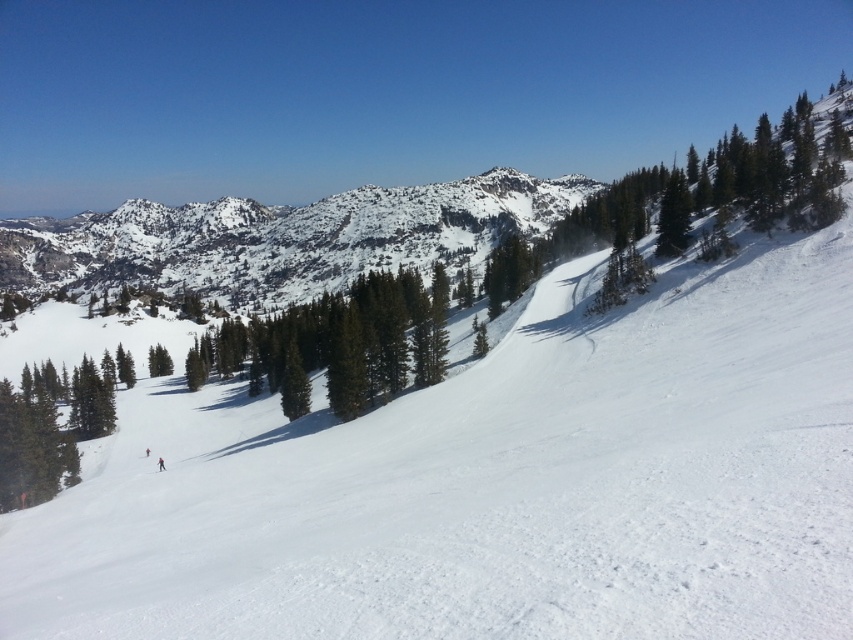
Question: Which of these objects is positioned closest to the green matte tree at center?

Choices:
 (A) snowy rocky mountain at center
 (B) red matte ski at lower left

Answer: (B)

Question: Can you confirm if snowy rocky mountain at center is smaller than green matte tree at center?

Choices:
 (A) no
 (B) yes

Answer: (A)

Question: Which of these objects is positioned closest to the red matte ski at lower left?

Choices:
 (A) snowy rocky mountain at center
 (B) green matte tree at center

Answer: (B)

Question: Can you confirm if snowy rocky mountain at center is positioned to the right of red matte ski at lower left?

Choices:
 (A) yes
 (B) no

Answer: (B)

Question: Does snowy rocky mountain at center appear on the left side of red matte ski at lower left?

Choices:
 (A) no
 (B) yes

Answer: (B)

Question: Among these points, which one is farthest from the camera?

Choices:
 (A) (289, 413)
 (B) (161, 467)

Answer: (A)